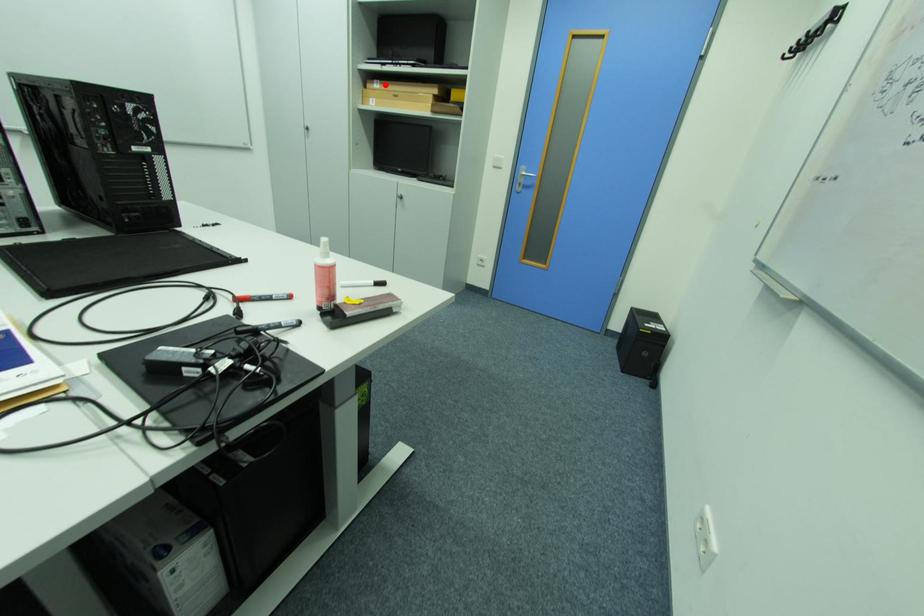
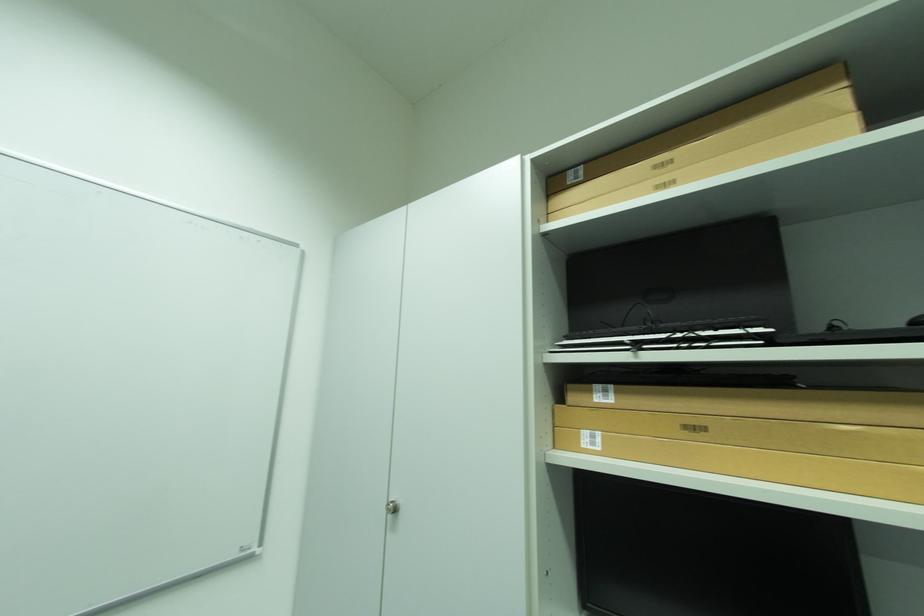
In the second image, find the point that corresponds to the highlighted location in the first image.

(614, 392)